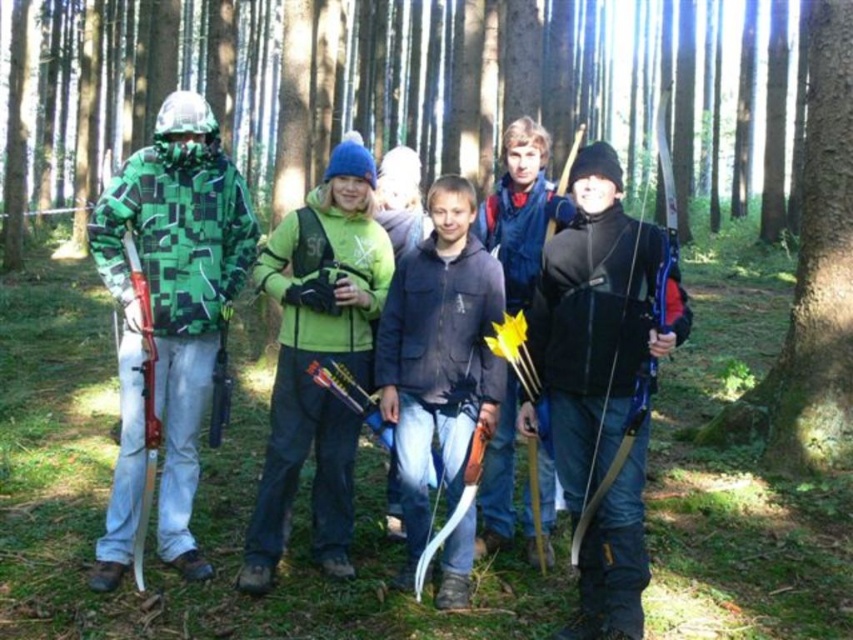
You are an archer standing in the forest and want to shoot an arrow to the dark blue jacket at center. The maximum distance your bow can shoot is 5 meters. Can you reach the jacket?

The distance between you and the dark blue jacket at center is 4.77 meters, which is within the 5 meters range of your bow. Yes, you can reach the jacket.

You are an archer in the forest and need to aim at two points marked in the scene. Which point, point (569,186) or point (540,243), is closer to you?

Point (569,186) is closer to the viewer than point (540,243).